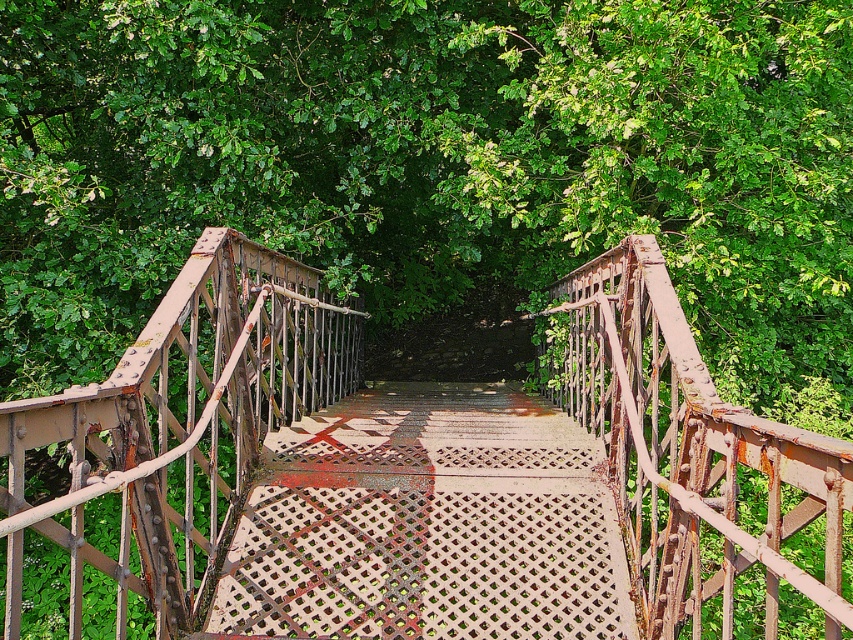
Question: Among these objects, which one is nearest to the camera?

Choices:
 (A) rusty metal staircase at center
 (B) rusty metal bridge at center

Answer: (B)

Question: Is rusty metal bridge at center smaller than rusty metal staircase at center?

Choices:
 (A) no
 (B) yes

Answer: (A)

Question: Observing the image, what is the correct spatial positioning of rusty metal bridge at center in reference to rusty metal staircase at center?

Choices:
 (A) below
 (B) above

Answer: (B)

Question: Can you confirm if rusty metal bridge at center is positioned to the left of rusty metal staircase at center?

Choices:
 (A) no
 (B) yes

Answer: (B)